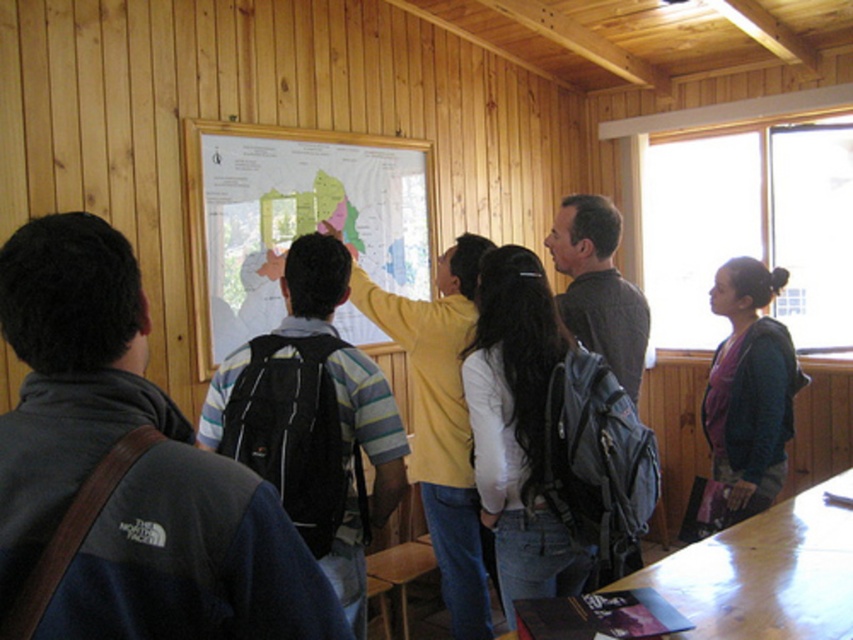
Between yellow matte shirt at center and purple fleece jacket at right, which one has less height?

Standing shorter between the two is purple fleece jacket at right.

Measure the distance from yellow matte shirt at center to purple fleece jacket at right.

They are 3.73 feet apart.

Where is `yellow matte shirt at center`? The image size is (853, 640). yellow matte shirt at center is located at coordinates (442, 422).

Find the location of a particular element. The height and width of the screenshot is (640, 853). yellow matte shirt at center is located at coordinates (x=442, y=422).

Can you confirm if white matte map at center is wider than yellow matte shirt at center?

Indeed, white matte map at center has a greater width compared to yellow matte shirt at center.

Is point (299, 188) behind point (364, 310)?

Yes, it is behind point (364, 310).

You are a GUI agent. You are given a task and a screenshot of the screen. Output one action in this format:
    pyautogui.click(x=<x>, y=<y>)
    Task: Click on the white matte map at center
    Image resolution: width=853 pixels, height=640 pixels.
    Given the screenshot: What is the action you would take?
    pyautogui.click(x=294, y=216)

Who is more forward, (196, 225) or (758, 438)?

Point (758, 438) is in front.

Which is behind, point (297, 147) or point (741, 272)?

Point (297, 147)

At what (x,y) coordinates should I click in order to perform the action: click on white matte map at center. Please return your answer as a coordinate pair (x, y). This screenshot has width=853, height=640. Looking at the image, I should click on (294, 216).